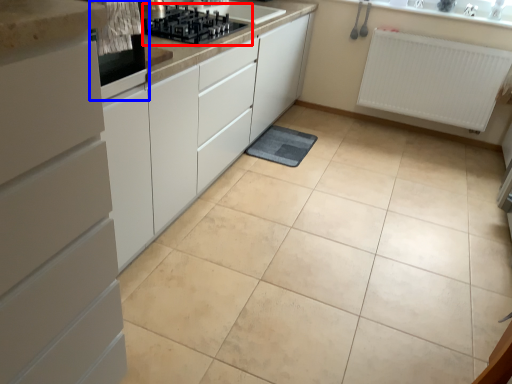
Question: Among these objects, which one is nearest to the camera, gas stove (highlighted by a red box) or home appliance (highlighted by a blue box)?

Choices:
 (A) gas stove
 (B) home appliance

Answer: (B)